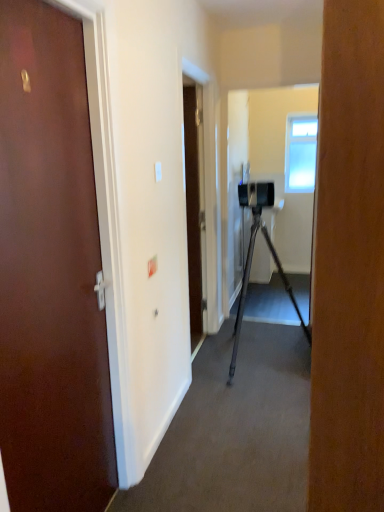
Question: Considering the positions of matte brown door at left and clear glass window at upper center in the image, is matte brown door at left bigger or smaller than clear glass window at upper center?

Choices:
 (A) big
 (B) small

Answer: (A)

Question: Considering the relative positions of matte brown door at left and clear glass window at upper center in the image provided, is matte brown door at left to the left or to the right of clear glass window at upper center?

Choices:
 (A) right
 (B) left

Answer: (B)

Question: Which is correct: matte brown door at left is inside clear glass window at upper center, or outside of it?

Choices:
 (A) outside
 (B) inside

Answer: (A)

Question: From a real-world perspective, is clear glass window at upper center physically located above or below matte brown door at left?

Choices:
 (A) below
 (B) above

Answer: (B)

Question: Is clear glass window at upper center taller or shorter than matte brown door at left?

Choices:
 (A) short
 (B) tall

Answer: (A)

Question: In terms of size, does clear glass window at upper center appear bigger or smaller than matte brown door at left?

Choices:
 (A) big
 (B) small

Answer: (B)

Question: Is clear glass window at upper center wider or thinner than matte brown door at left?

Choices:
 (A) wide
 (B) thin

Answer: (B)